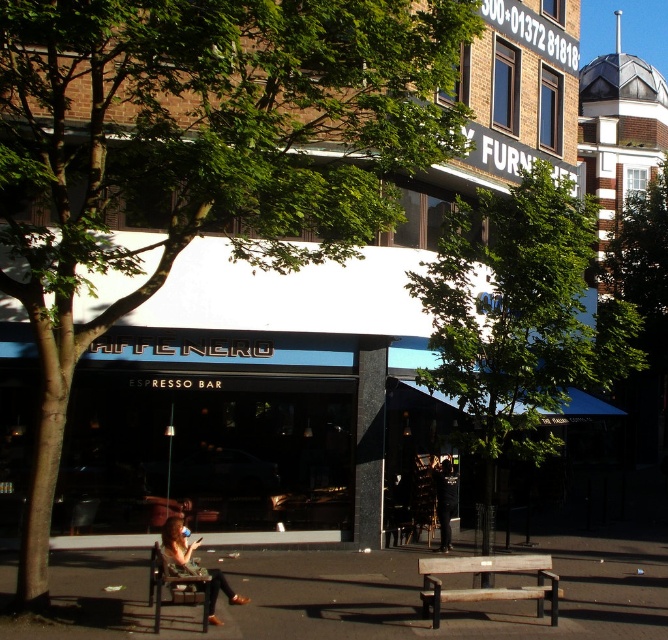
Which of these two, wooden bench at center or wooden bench at lower left, stands taller?

wooden bench at center

Consider the image. Can you confirm if wooden bench at center is positioned below wooden bench at lower left?

Correct, wooden bench at center is located below wooden bench at lower left.

What do you see at coordinates (488, 580) in the screenshot? This screenshot has width=668, height=640. I see `wooden bench at center` at bounding box center [488, 580].

At what (x,y) coordinates should I click in order to perform the action: click on wooden bench at center. Please return your answer as a coordinate pair (x, y). This screenshot has width=668, height=640. Looking at the image, I should click on (488, 580).

Does green leafy tree at center appear under matte brown hair at lower center?

No.

Is point (641, 360) positioned before point (216, 592)?

No, (641, 360) is behind (216, 592).

Where is `green leafy tree at center`? This screenshot has height=640, width=668. green leafy tree at center is located at coordinates (518, 317).

Can you confirm if green leafy tree at center is bigger than wooden bench at lower left?

Yes, green leafy tree at center is bigger than wooden bench at lower left.

How far apart are green leafy tree at center and wooden bench at lower left?

green leafy tree at center and wooden bench at lower left are 3.44 meters apart from each other.

Who is more forward, (450, 224) or (158, 566)?

Point (158, 566)

You are a GUI agent. You are given a task and a screenshot of the screen. Output one action in this format:
    pyautogui.click(x=<x>, y=<y>)
    Task: Click on the green leafy tree at center
    The image size is (668, 640).
    Given the screenshot: What is the action you would take?
    pyautogui.click(x=518, y=317)